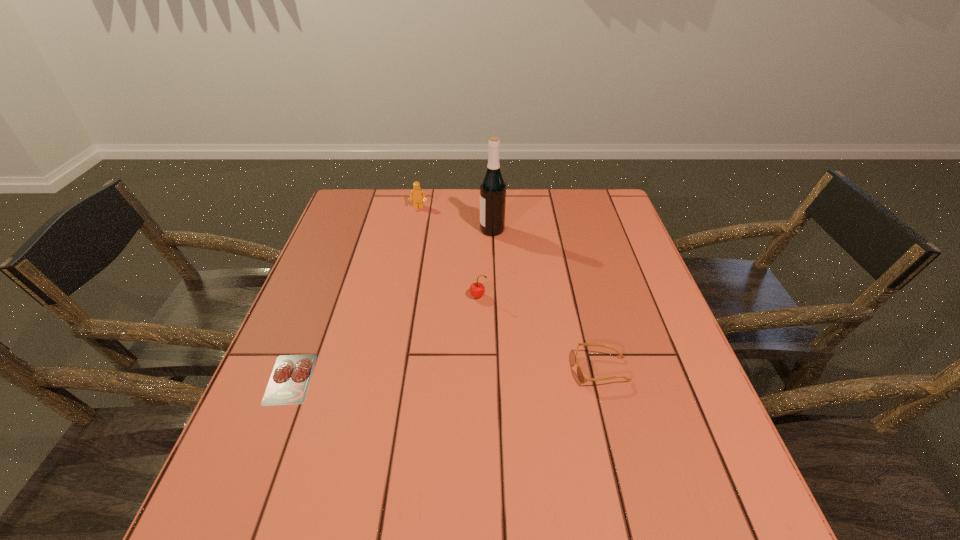
I want to click on object that is at the left edge, so click(291, 375).

I want to click on object at the right edge, so click(x=582, y=378).

This screenshot has width=960, height=540. In order to click on free space at the far edge of the desktop in this screenshot , I will do `click(513, 205)`.

Image resolution: width=960 pixels, height=540 pixels. In the image, there is a desktop. Identify the location of free space at the near edge. (344, 495).

The width and height of the screenshot is (960, 540). Identify the location of free point at the left edge. (305, 284).

Where is `vacant area at the right edge of the desktop`? Image resolution: width=960 pixels, height=540 pixels. vacant area at the right edge of the desktop is located at coordinates (637, 400).

Image resolution: width=960 pixels, height=540 pixels. In the image, there is a desktop. Find the location of `blank space at the far right corner`. blank space at the far right corner is located at coordinates pos(615,208).

Identify the location of vacant space that is in between the cherry and the salami. The height and width of the screenshot is (540, 960). (384, 338).

This screenshot has height=540, width=960. I want to click on vacant region between the third farthest object and the fourth object from right to left, so click(448, 252).

The width and height of the screenshot is (960, 540). Identify the location of unoccupied position between the cherry and the wine bottle. (485, 263).